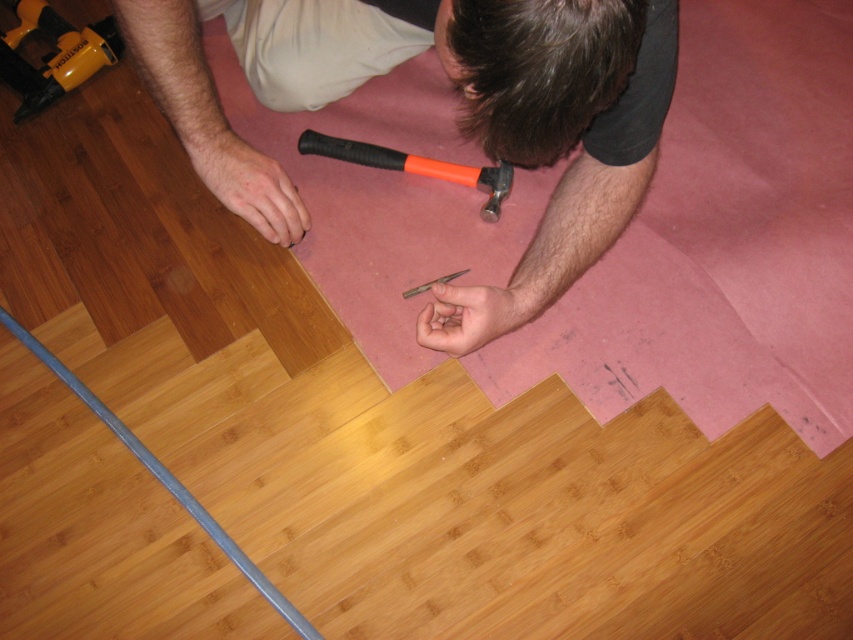
Who is more forward, (42, 29) or (465, 269)?

Point (465, 269) is more forward.

Does yellow plastic drill at upper left have a larger size compared to metallic silver screwdriver at center?

Yes, yellow plastic drill at upper left is bigger than metallic silver screwdriver at center.

Image resolution: width=853 pixels, height=640 pixels. What do you see at coordinates (54, 54) in the screenshot?
I see `yellow plastic drill at upper left` at bounding box center [54, 54].

At what (x,y) coordinates should I click in order to perform the action: click on yellow plastic drill at upper left. Please return your answer as a coordinate pair (x, y). The width and height of the screenshot is (853, 640). Looking at the image, I should click on pos(54,54).

Can you confirm if orange rubber handle hammer at center is bigger than metallic silver screwdriver at center?

Indeed, orange rubber handle hammer at center has a larger size compared to metallic silver screwdriver at center.

Can you confirm if orange rubber handle hammer at center is smaller than metallic silver screwdriver at center?

No.

Between point (490, 168) and point (415, 291), which one is positioned behind?

Point (490, 168)

Find the location of a particular element. Image resolution: width=853 pixels, height=640 pixels. orange rubber handle hammer at center is located at coordinates (415, 166).

Who is positioned more to the right, dark brown wood plank at upper center or yellow plastic drill at upper left?

dark brown wood plank at upper center is more to the right.

Is dark brown wood plank at upper center wider than yellow plastic drill at upper left?

Indeed, dark brown wood plank at upper center has a greater width compared to yellow plastic drill at upper left.

Who is more distant from viewer, (x=448, y=323) or (x=49, y=90)?

The point (x=49, y=90) is more distant.

The height and width of the screenshot is (640, 853). I want to click on dark brown wood plank at upper center, so click(540, 65).